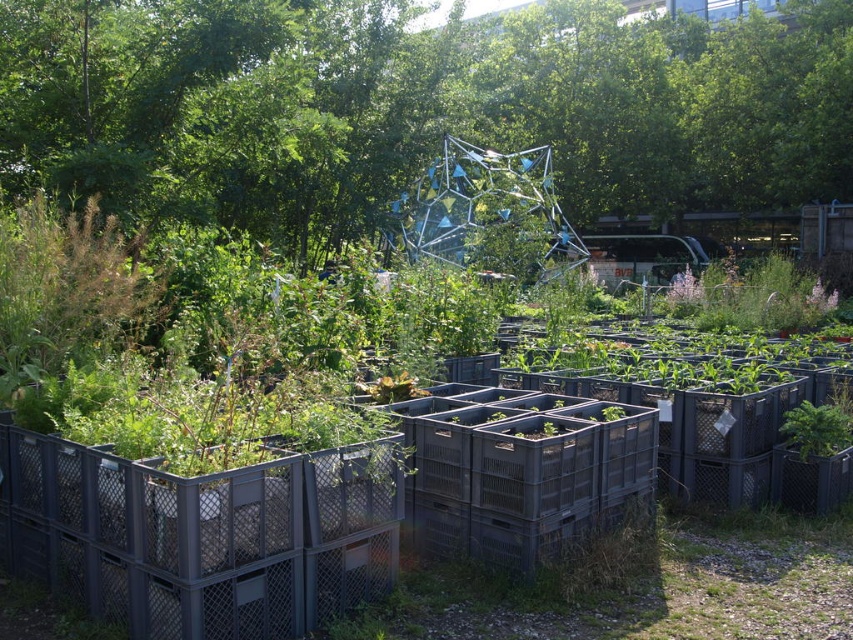
Question: Can you confirm if green leafy tree at center is bigger than gray plastic crates at center?

Choices:
 (A) no
 (B) yes

Answer: (B)

Question: Which of the following is the farthest from the observer?

Choices:
 (A) green leafy tree at center
 (B) gray plastic crates at center

Answer: (A)

Question: Does green leafy tree at center appear over gray plastic crates at center?

Choices:
 (A) no
 (B) yes

Answer: (B)

Question: Is green leafy tree at center behind gray plastic crates at center?

Choices:
 (A) yes
 (B) no

Answer: (A)

Question: Which point appears farthest from the camera in this image?

Choices:
 (A) (39, 496)
 (B) (566, 212)

Answer: (B)